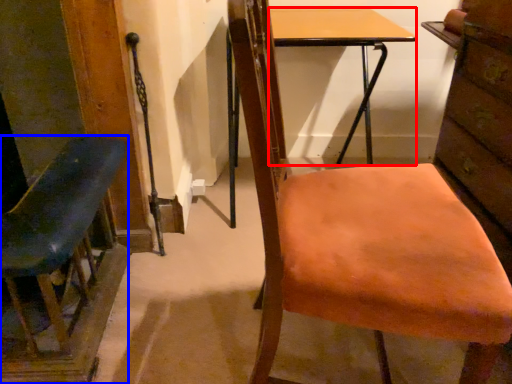
Question: Which object appears closest to the camera in this image, desk (highlighted by a red box) or chair (highlighted by a blue box)?

Choices:
 (A) desk
 (B) chair

Answer: (B)